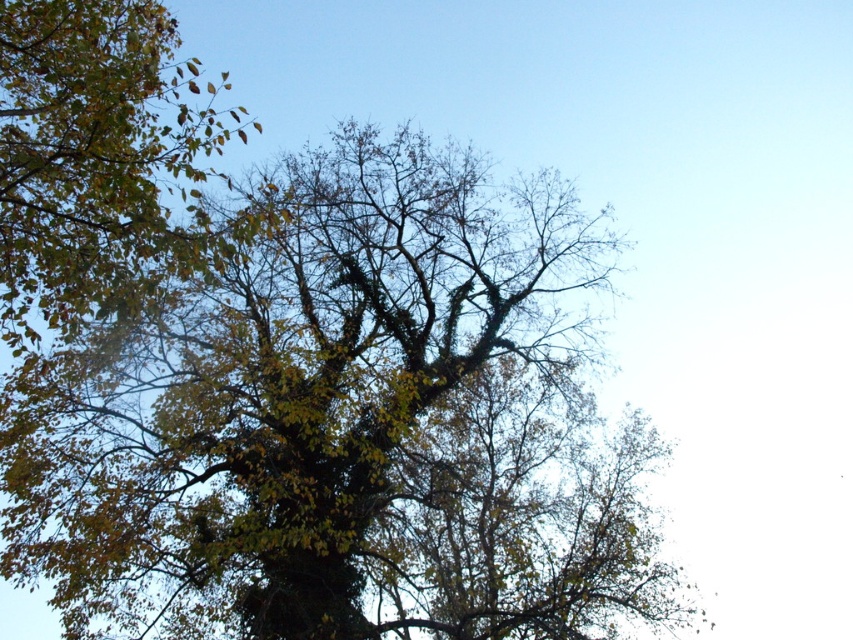
Does green leafy oak tree at center have a greater width compared to green leafy tree at upper left?

Yes.

Does green leafy oak tree at center appear on the right side of green leafy tree at upper left?

Indeed, green leafy oak tree at center is positioned on the right side of green leafy tree at upper left.

Describe the element at coordinates (344, 424) in the screenshot. I see `green leafy oak tree at center` at that location.

Image resolution: width=853 pixels, height=640 pixels. In order to click on green leafy oak tree at center in this screenshot , I will do `click(344, 424)`.